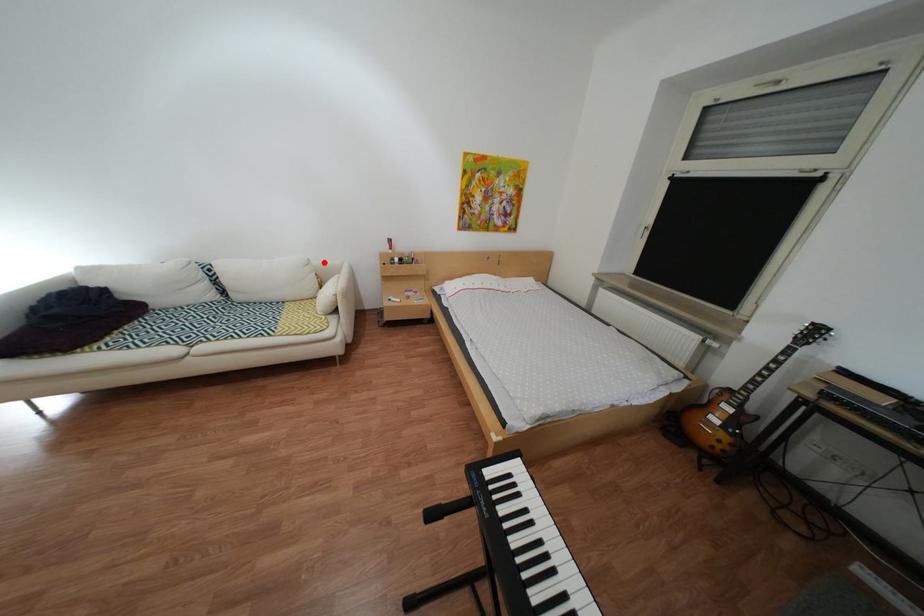
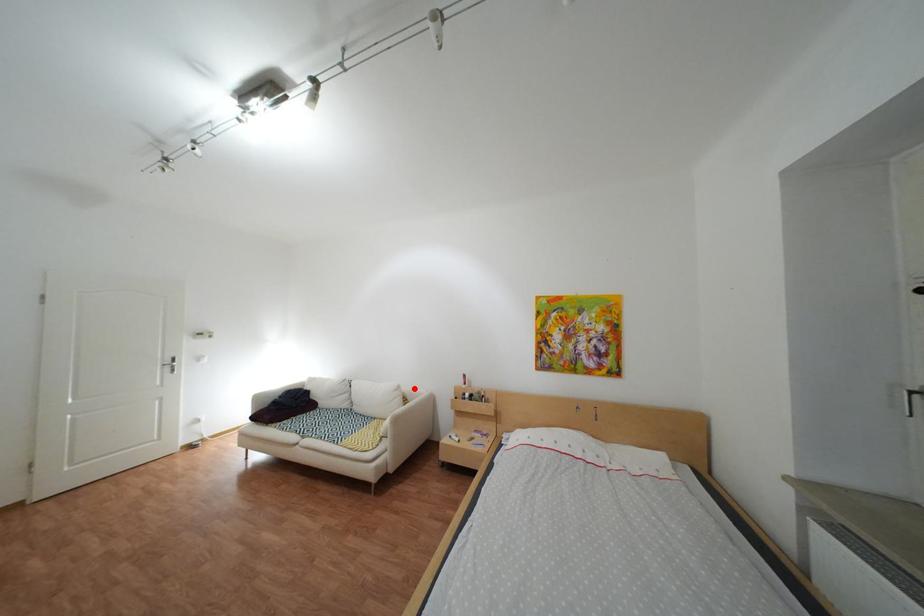
I am providing you with two images of the same scene from different viewpoints. A red point is marked on the first image and another point is marked on the second image. Does the point marked in image1 correspond to the same location as the one in image2?

Yes